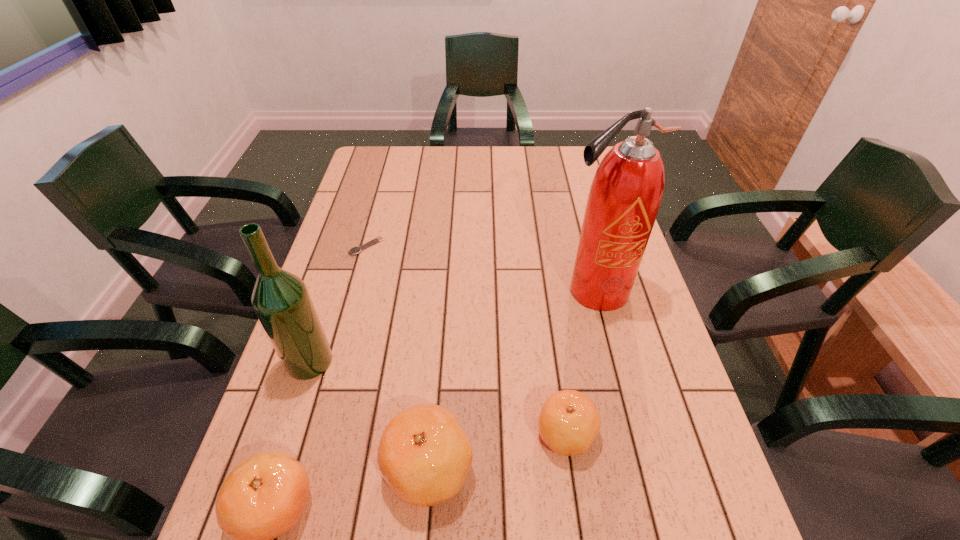
I want to click on vacant space at the far left corner, so click(x=365, y=148).

You are a GUI agent. You are given a task and a screenshot of the screen. Output one action in this format:
    pyautogui.click(x=<x>, y=<y>)
    Task: Click on the vacant space at the near right corner of the desktop
    This screenshot has width=960, height=540.
    Given the screenshot: What is the action you would take?
    pyautogui.click(x=722, y=499)

Identify the location of unoccupied position between the fourth object from left to right and the fifth nearest object. (512, 379).

In order to click on free area in between the farthest object and the fifth tallest object in this screenshot , I will do `click(467, 340)`.

The image size is (960, 540). What are the coordinates of `free point between the fifth shortest object and the second shortest object` in the screenshot? It's located at (438, 397).

Find the location of a particular element. Image resolution: width=960 pixels, height=540 pixels. vacant space in between the second clementine from right to left and the fifth shortest object is located at coordinates (369, 415).

Identify the location of vacant area that lies between the fifth shortest object and the watch. The height and width of the screenshot is (540, 960). (338, 304).

Locate an element on the screen. This screenshot has width=960, height=540. free space between the third object from right to left and the shortest object is located at coordinates (x=397, y=357).

You are a GUI agent. You are given a task and a screenshot of the screen. Output one action in this format:
    pyautogui.click(x=<x>, y=<y>)
    Task: Click on the free space between the fifth nearest object and the shortest clementine
    This screenshot has height=540, width=960.
    Given the screenshot: What is the action you would take?
    pyautogui.click(x=580, y=362)

I want to click on vacant space that's between the farthest object and the second tallest object, so click(x=338, y=304).